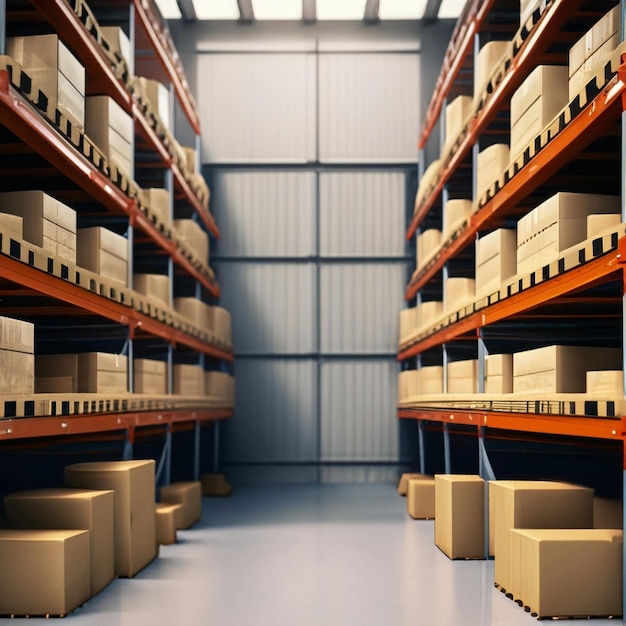
Where is `shelves`? This screenshot has height=626, width=626. shelves is located at coordinates (439, 101), (463, 131), (486, 203), (496, 305), (516, 414), (90, 419), (89, 303), (126, 201), (162, 153), (177, 88).